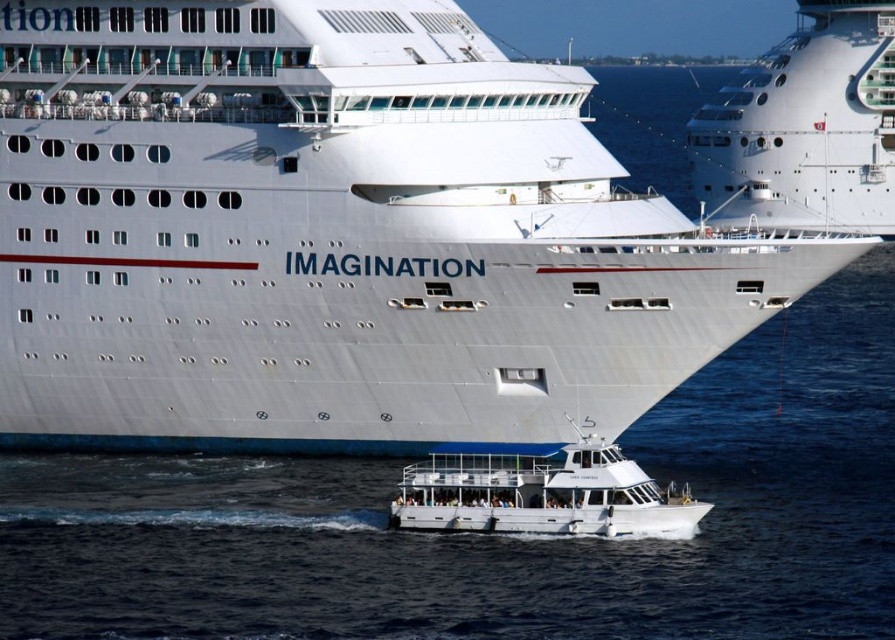
Question: Is the position of white glossy ship at upper center less distant than that of white matte boat at lower center?

Choices:
 (A) no
 (B) yes

Answer: (A)

Question: Considering the real-world distances, which object is farthest from the clear blue water at center?

Choices:
 (A) white glossy cruise ship at center
 (B) white glossy ship at upper center

Answer: (B)

Question: Which point is closer to the camera?

Choices:
 (A) white glossy cruise ship at center
 (B) white matte boat at lower center
 (C) clear blue water at center
 (D) white glossy ship at upper center

Answer: (C)

Question: Which of the following is the farthest from the observer?

Choices:
 (A) white glossy cruise ship at center
 (B) white matte boat at lower center
 (C) white glossy ship at upper center

Answer: (C)

Question: Can you confirm if white glossy cruise ship at center is positioned to the right of white matte boat at lower center?

Choices:
 (A) no
 (B) yes

Answer: (B)

Question: Is white glossy cruise ship at center thinner than clear blue water at center?

Choices:
 (A) yes
 (B) no

Answer: (A)